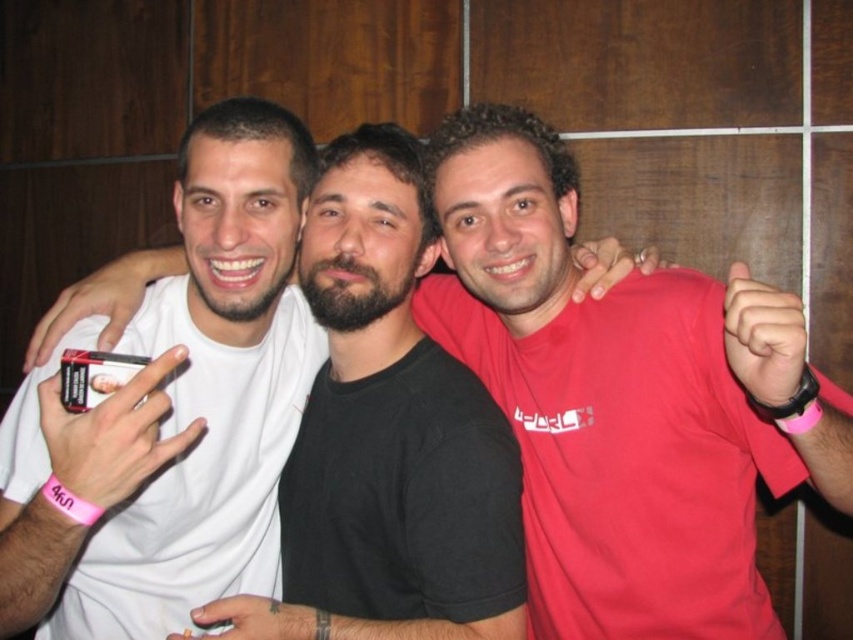
You are a photographer at the event and want to capture a closeup of the pink rubber wristband at upper right. Where should you focus your camera?

The pink rubber wristband at upper right is located at point (619, 397), so you should focus your camera there.